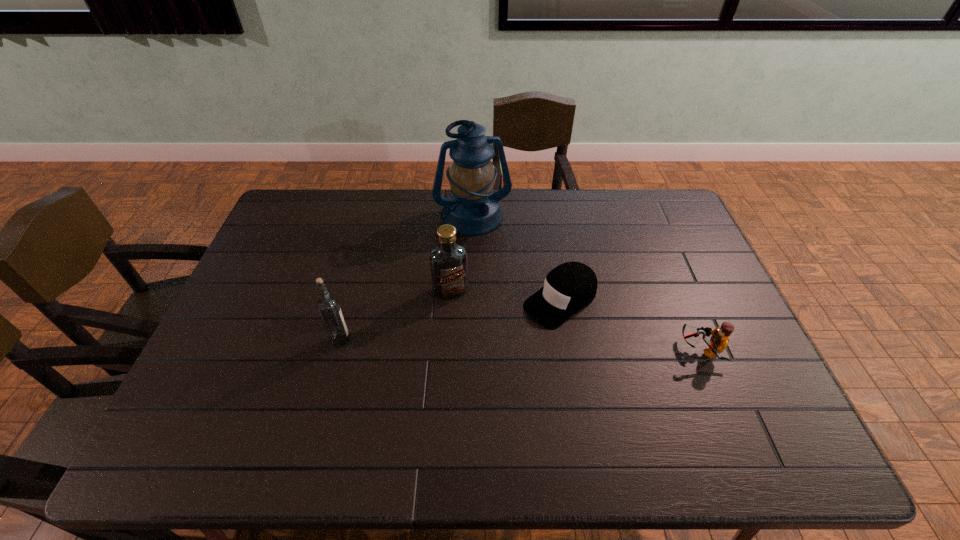
At what (x,y) coordinates should I click in order to perform the action: click on vacant space positioned 0.220m on the front-facing side of the right vodka. Please return your answer as a coordinate pair (x, y). This screenshot has width=960, height=540. Looking at the image, I should click on (480, 361).

You are a GUI agent. You are given a task and a screenshot of the screen. Output one action in this format:
    pyautogui.click(x=<x>, y=<y>)
    Task: Click on the free space located 0.350m on the front-facing side of the right vodka
    The width and height of the screenshot is (960, 540).
    Given the screenshot: What is the action you would take?
    pyautogui.click(x=498, y=404)

I want to click on object that is positioned at the far edge, so click(473, 209).

At what (x,y) coordinates should I click in order to perform the action: click on object present at the right edge. Please return your answer as a coordinate pair (x, y). Looking at the image, I should click on (719, 340).

Where is `vacant space at the far edge of the desktop`? vacant space at the far edge of the desktop is located at coordinates (612, 195).

Find the location of a particular element. The width and height of the screenshot is (960, 540). vacant point at the near edge is located at coordinates (432, 389).

Find the location of a particular element. free location at the left edge is located at coordinates (263, 316).

You are a GUI agent. You are given a task and a screenshot of the screen. Output one action in this format:
    pyautogui.click(x=<x>, y=<y>)
    Task: Click on the vacant space at the right edge of the desktop
    The image size is (960, 540).
    Given the screenshot: What is the action you would take?
    pyautogui.click(x=700, y=356)

Image resolution: width=960 pixels, height=540 pixels. Find the location of `free space at the far left corner of the desktop`. free space at the far left corner of the desktop is located at coordinates (304, 225).

Where is `free space at the near left corner of the desktop`? The image size is (960, 540). free space at the near left corner of the desktop is located at coordinates (212, 411).